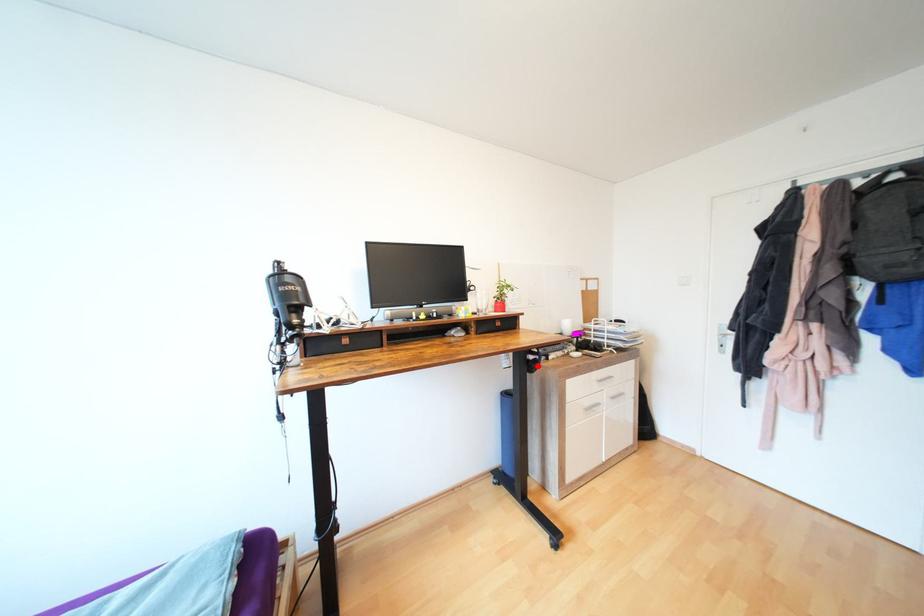
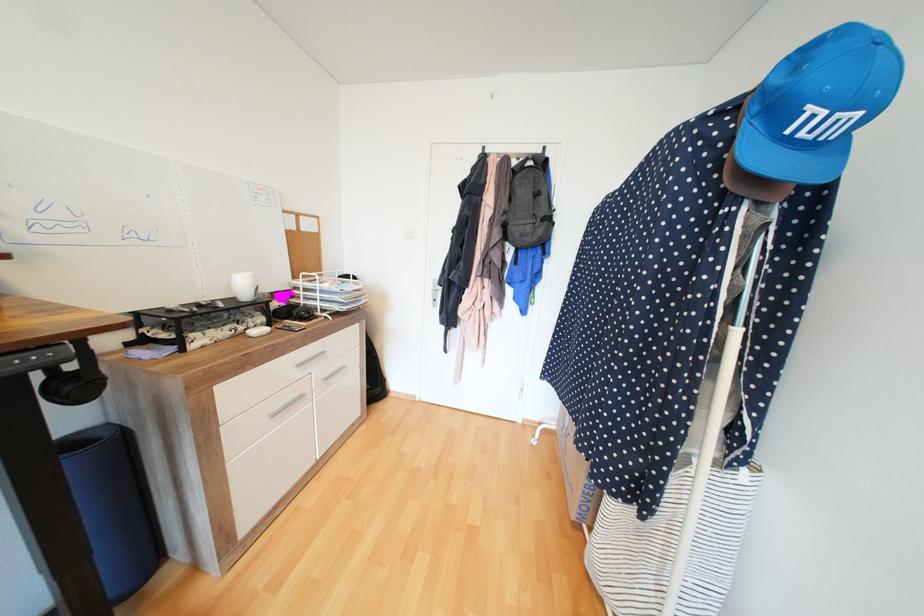
In the second image, find the point that corresponds to the highlighted location in the first image.

(88, 387)